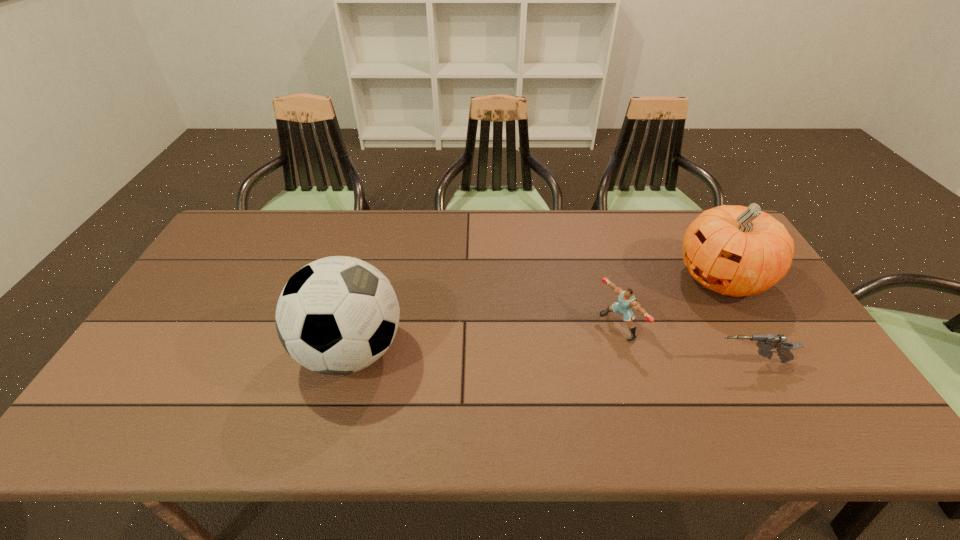
This screenshot has width=960, height=540. Identify the location of the leftmost object. (337, 315).

You are a GUI agent. You are given a task and a screenshot of the screen. Output one action in this format:
    pyautogui.click(x=<x>, y=<y>)
    Task: Click on the shortest object
    
    Given the screenshot: What is the action you would take?
    pyautogui.click(x=767, y=342)

Locate an element on the screen. The image size is (960, 540). pumpkin is located at coordinates (734, 250).

At what (x,y) coordinates should I click in order to perform the action: click on the third object from right to left. Please return your answer as a coordinate pair (x, y). Image resolution: width=960 pixels, height=540 pixels. Looking at the image, I should click on (626, 300).

I want to click on puncher, so click(626, 300).

Identify the location of blank space located 0.280m on the main logo of the leftmost object. The width and height of the screenshot is (960, 540). (514, 352).

This screenshot has height=540, width=960. In order to click on vacant position located at the barrel of the shortest object in this screenshot , I will do `click(562, 362)`.

The height and width of the screenshot is (540, 960). In order to click on vacant space located at the barrel of the shortest object in this screenshot , I will do `click(648, 362)`.

Locate an element on the screen. free space located at the barrel of the shortest object is located at coordinates (660, 362).

Where is `vacant region located on the front-facing side of the pumpkin`? This screenshot has height=540, width=960. vacant region located on the front-facing side of the pumpkin is located at coordinates (631, 324).